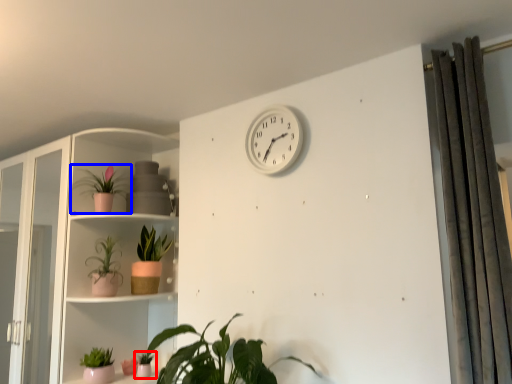
Question: Among these objects, which one is farthest to the camera, houseplant (highlighted by a red box) or houseplant (highlighted by a blue box)?

Choices:
 (A) houseplant
 (B) houseplant

Answer: (A)